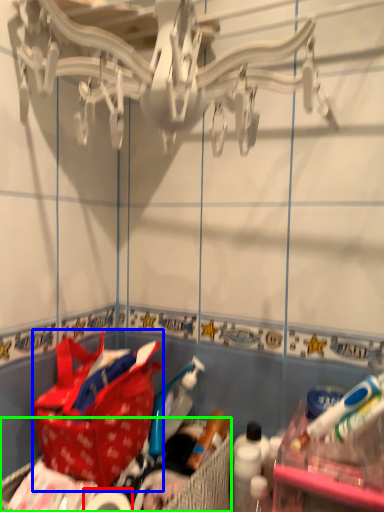
Question: Which object is the closest to the toilet paper (highlighted by a red box)? Choose among these: handbag (highlighted by a blue box) or picnic basket (highlighted by a green box).

Choices:
 (A) handbag
 (B) picnic basket

Answer: (B)